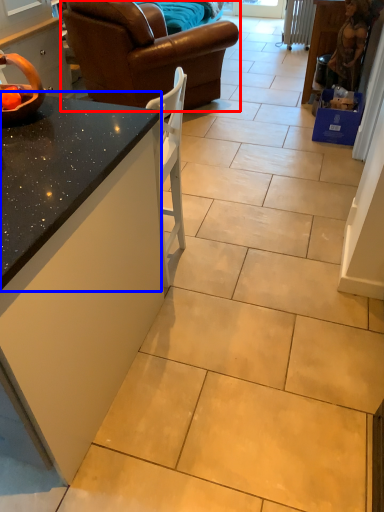
Question: Which object is further to the camera taking this photo, studio couch (highlighted by a red box) or countertop (highlighted by a blue box)?

Choices:
 (A) studio couch
 (B) countertop

Answer: (A)